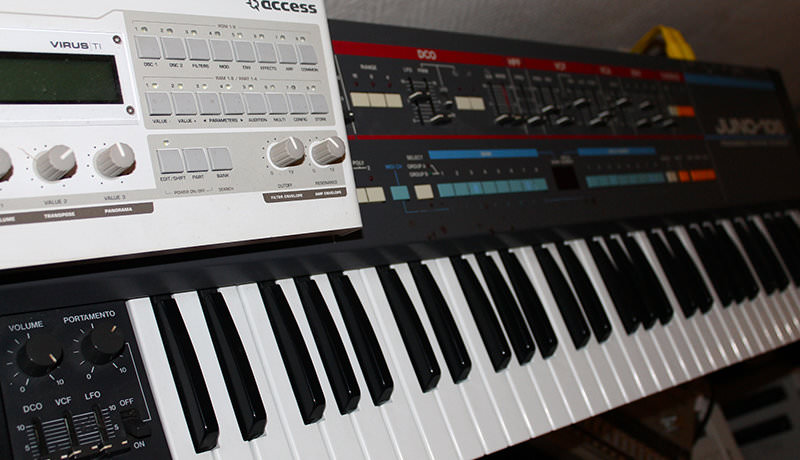
Identify the location of digital display. (64, 90).